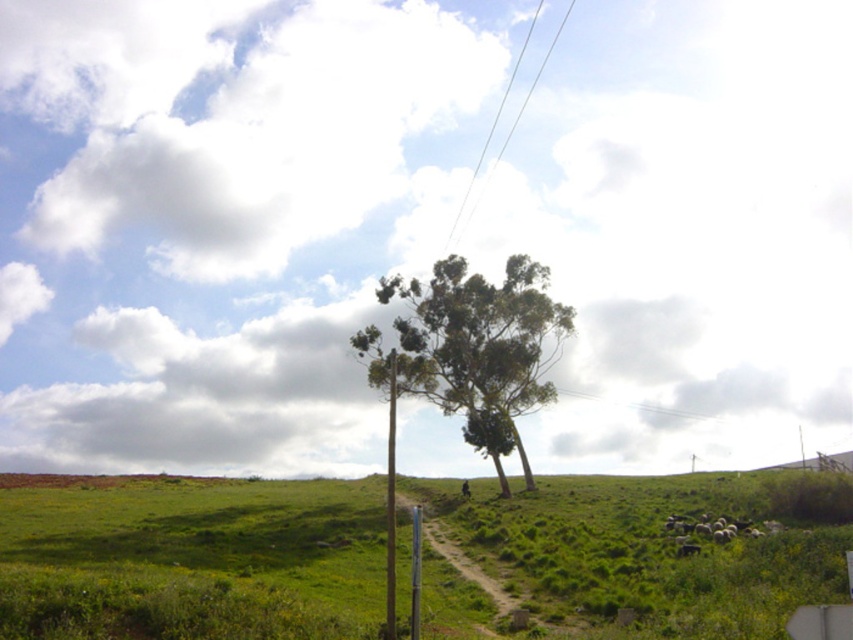
Question: Which of the following is the farthest from the observer?

Choices:
 (A) click(x=479, y=163)
 (B) click(x=440, y=554)
 (C) click(x=22, y=477)

Answer: (A)

Question: Which object is farther from the camera taking this photo?

Choices:
 (A) green grassy hill at center
 (B) dirt path at center
 (C) metallic pole at center

Answer: (C)

Question: Which point is farther to the camera?

Choices:
 (A) clear wire at upper center
 (B) dirt path at center
 (C) metallic pole at center

Answer: (A)

Question: Is green leafy tree at center below dirt path at center?

Choices:
 (A) yes
 (B) no

Answer: (B)

Question: Can you confirm if green leafy tree at center is bigger than dirt path at center?

Choices:
 (A) no
 (B) yes

Answer: (B)

Question: Does clear wire at upper center have a larger size compared to metallic pole at center?

Choices:
 (A) yes
 (B) no

Answer: (A)